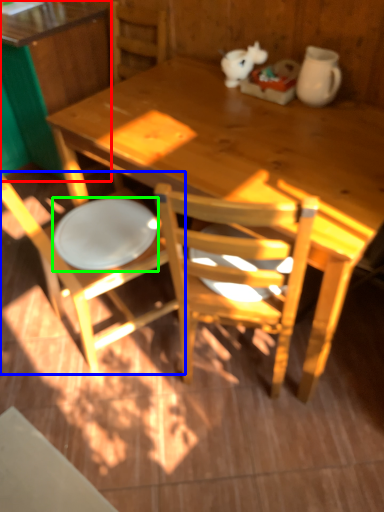
Question: Based on their relative distances, which object is nearer to desk (highlighted by a red box)? Choose from chair (highlighted by a blue box) and plate (highlighted by a green box).

Choices:
 (A) chair
 (B) plate

Answer: (B)